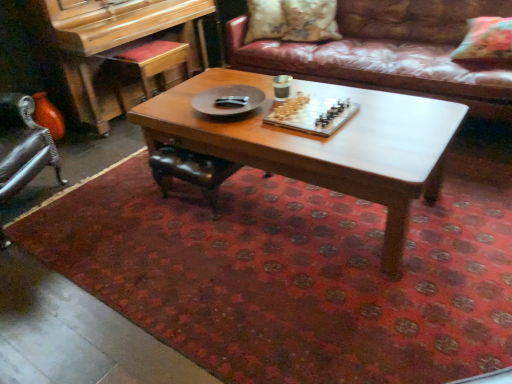
Question: Which direction should I rotate to look at fluffy beige pillow at upper center, which appears as the second pillow when viewed from the left?

Choices:
 (A) right
 (B) left

Answer: (A)

Question: Is floral fabric pillow at upper right, arranged as the third pillow when viewed from the left, touching wooden chessboard at center?

Choices:
 (A) no
 (B) yes

Answer: (A)

Question: Is floral fabric pillow at upper right, arranged as the third pillow when viewed from the left, facing towards wooden chessboard at center?

Choices:
 (A) yes
 (B) no

Answer: (A)

Question: Does floral fabric pillow at upper right, which is the third pillow in back-to-front order, have a lesser height compared to wooden chessboard at center?

Choices:
 (A) yes
 (B) no

Answer: (A)

Question: Is floral fabric pillow at upper right, which is the third pillow in back-to-front order, turned away from wooden chessboard at center?

Choices:
 (A) yes
 (B) no

Answer: (B)

Question: Considering the relative positions of floral fabric pillow at upper right, acting as the 1th pillow starting from the right, and wooden chessboard at center in the image provided, is floral fabric pillow at upper right, acting as the 1th pillow starting from the right, to the right of wooden chessboard at center from the viewer's perspective?

Choices:
 (A) no
 (B) yes

Answer: (B)

Question: Is floral fabric pillow at upper right, acting as the 1th pillow starting from the right, further to the viewer compared to wooden chessboard at center?

Choices:
 (A) yes
 (B) no

Answer: (A)

Question: Is floral fabric pillow at upper right, which is the third pillow in back-to-front order, smaller than floral fabric pillow at upper center, arranged as the third pillow when viewed from the right?

Choices:
 (A) yes
 (B) no

Answer: (A)

Question: Would you say floral fabric pillow at upper right, arranged as the third pillow when viewed from the left, is outside floral fabric pillow at upper center, placed as the 1th pillow when sorted from back to front?

Choices:
 (A) no
 (B) yes

Answer: (B)

Question: Does floral fabric pillow at upper right, acting as the 1th pillow starting from the right, have a larger size compared to floral fabric pillow at upper center, which is counted as the first pillow, starting from the left?

Choices:
 (A) no
 (B) yes

Answer: (A)

Question: Does floral fabric pillow at upper right, which ranks as the first pillow in front-to-back order, appear on the left side of floral fabric pillow at upper center, which is counted as the first pillow, starting from the left?

Choices:
 (A) yes
 (B) no

Answer: (B)

Question: Considering the relative sizes of floral fabric pillow at upper right, acting as the 1th pillow starting from the right, and floral fabric pillow at upper center, which is counted as the first pillow, starting from the left, in the image provided, is floral fabric pillow at upper right, acting as the 1th pillow starting from the right, shorter than floral fabric pillow at upper center, which is counted as the first pillow, starting from the left,?

Choices:
 (A) no
 (B) yes

Answer: (B)

Question: Is floral fabric pillow at upper right, acting as the 1th pillow starting from the right, positioned behind floral fabric pillow at upper center, arranged as the third pillow when viewed from the right?

Choices:
 (A) yes
 (B) no

Answer: (B)

Question: Does floral fabric pillow at upper right, acting as the 1th pillow starting from the right, turn towards fluffy beige pillow at upper center, which appears as the second pillow when viewed from the right?

Choices:
 (A) no
 (B) yes

Answer: (A)